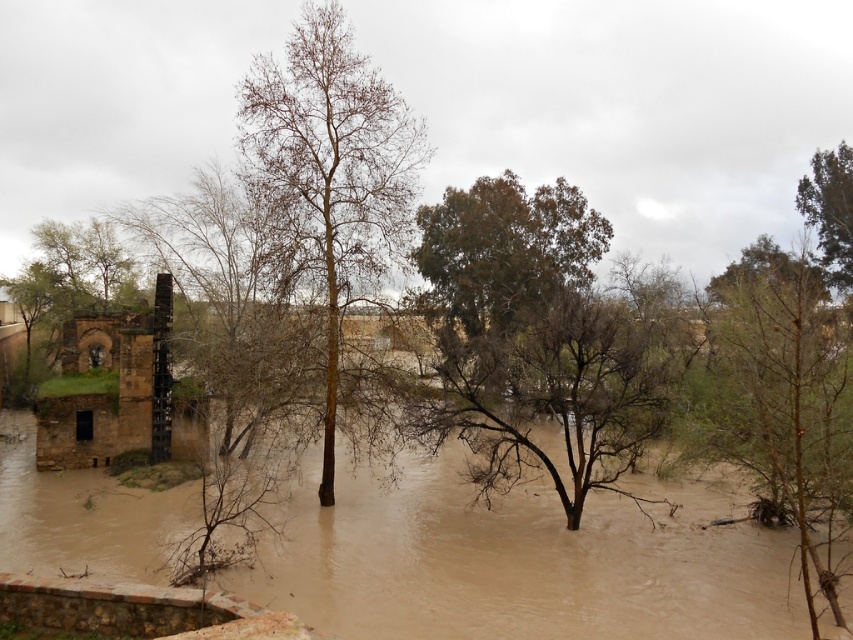
Question: Which of these objects is positioned farthest from the green leafy tree at upper right?

Choices:
 (A) green leafy tree at center
 (B) bare wood tree at center
 (C) brown muddy water at center

Answer: (B)

Question: Does brown muddy water at center appear over green leafy tree at upper right?

Choices:
 (A) no
 (B) yes

Answer: (A)

Question: Does bare wood tree at center have a lesser width compared to green leafy tree at center?

Choices:
 (A) yes
 (B) no

Answer: (A)

Question: Is brown muddy water at center bigger than bare wood tree at center?

Choices:
 (A) no
 (B) yes

Answer: (B)

Question: Which object is farther from the camera taking this photo?

Choices:
 (A) bare wood tree at center
 (B) green leafy tree at center

Answer: (A)

Question: Which object is the farthest from the green leafy tree at upper right?

Choices:
 (A) bare wood tree at center
 (B) brown muddy water at center
 (C) green leafy tree at center

Answer: (A)